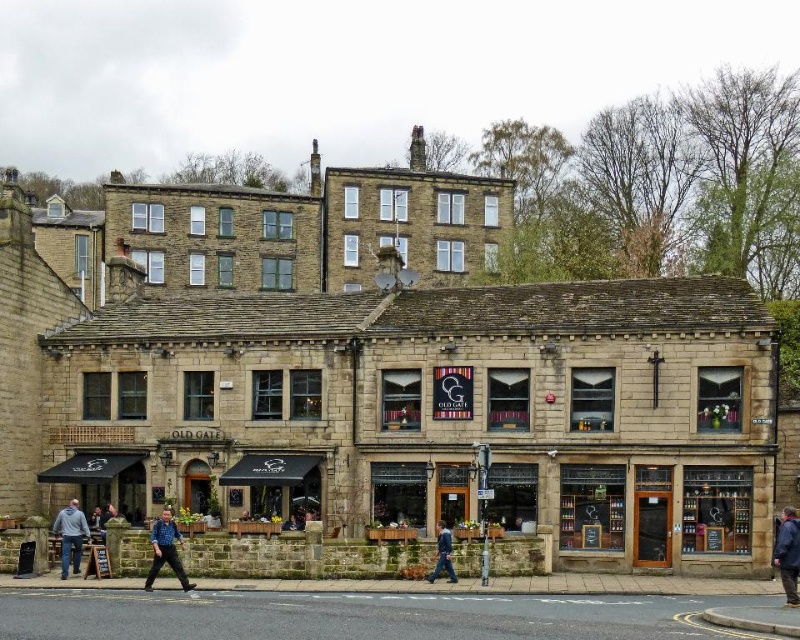
You are a customer entering the building and see both the blue fabric jacket at lower right and the blue denim jacket at center. Which jacket is closer to you as you approach the entrance?

The blue fabric jacket at lower right is closer to you because it is in front of the blue denim jacket at center.

Consider the image. You are a customer at the cafe in the building. You see a blue fabric jacket at lower right and blue denim jeans at lower left. Which item is placed on top of the other?

The blue fabric jacket at lower right is positioned over blue denim jeans at lower left.

Based on the photo, you are a tourist standing in front of the stone building at center and the blue denim jacket at center. You want to take a photo that includes both objects. Which one should you zoom in on to ensure both fit in the frame?

The stone building at center is larger in size than the blue denim jacket at center, so you should zoom out to include both in the frame.